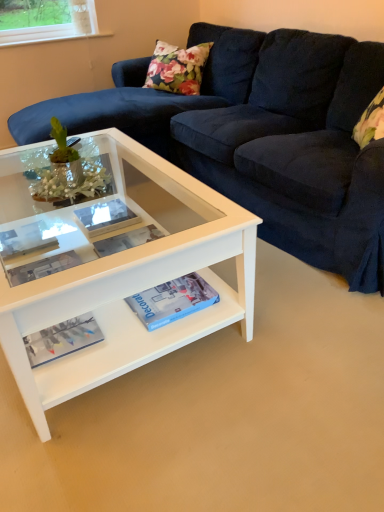
You are a GUI agent. You are given a task and a screenshot of the screen. Output one action in this format:
    pyautogui.click(x=<x>, y=<y>)
    Task: Click on the free space above blue matte paperback book at center, the 2th paperback book positioned from the back (from a real-world perspective)
    This screenshot has height=512, width=384.
    Given the screenshot: What is the action you would take?
    pyautogui.click(x=167, y=293)